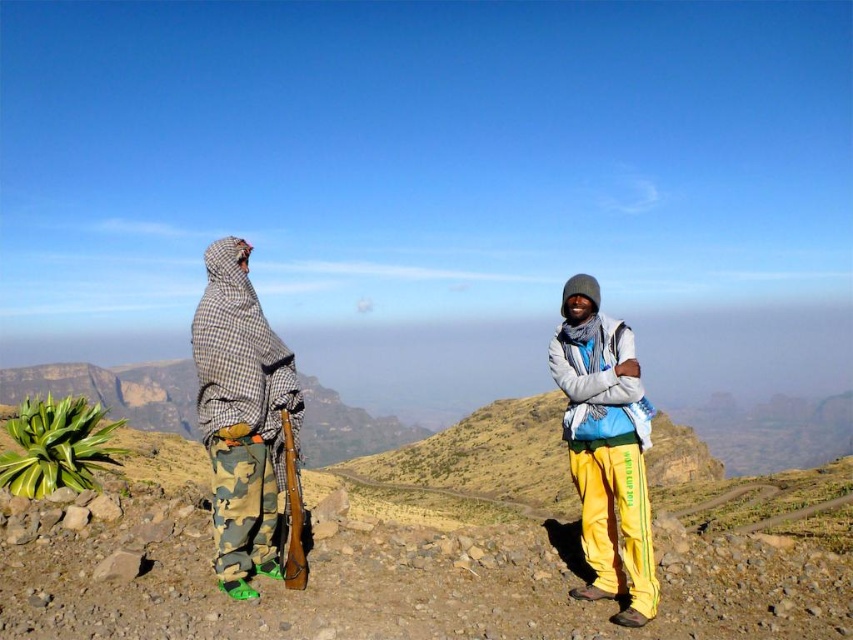
What do you see at coordinates (606, 449) in the screenshot?
I see `camouflage pants at left` at bounding box center [606, 449].

Does camouflage pants at left have a greater height compared to camo fabric ski at left?

Correct, camouflage pants at left is much taller as camo fabric ski at left.

The height and width of the screenshot is (640, 853). In order to click on camouflage pants at left in this screenshot , I will do `click(606, 449)`.

Is point (585, 355) positioned after point (582, 595)?

That is True.

Who is lower down, camouflage pants at left or yellow fleece pants at right?

yellow fleece pants at right is below.

What do you see at coordinates (606, 449) in the screenshot? The width and height of the screenshot is (853, 640). I see `camouflage pants at left` at bounding box center [606, 449].

Where is `camouflage pants at left`? camouflage pants at left is located at coordinates (606, 449).

Does camo fabric ski at left have a lesser width compared to yellow fleece pants at right?

No, camo fabric ski at left is not thinner than yellow fleece pants at right.

Is camo fabric ski at left to the left of yellow fleece pants at right from the viewer's perspective?

Yes, camo fabric ski at left is to the left of yellow fleece pants at right.

Locate an element on the screen. camo fabric ski at left is located at coordinates (241, 416).

This screenshot has height=640, width=853. Identify the location of camo fabric ski at left. (241, 416).